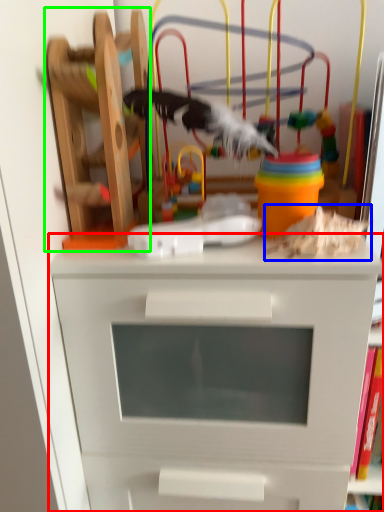
Question: Which is farther away from chest of drawers (highlighted by a red box)? toy (highlighted by a blue box) or toy (highlighted by a green box)?

Choices:
 (A) toy
 (B) toy

Answer: (B)